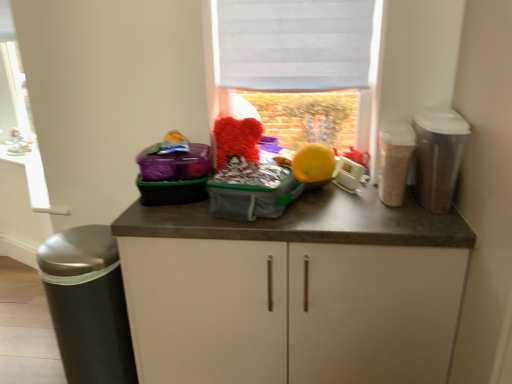
This screenshot has width=512, height=384. I want to click on empty space that is to the right of plastic gray bag at center, so click(x=315, y=216).